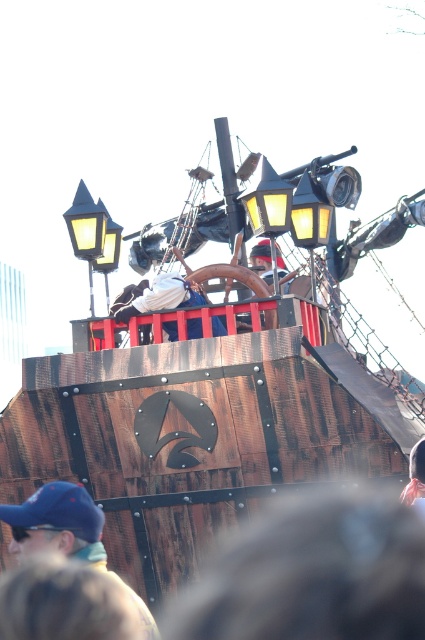
How far apart are blue fabric cap at lower left and white fabric at center?

blue fabric cap at lower left is 16.23 meters away from white fabric at center.

Between blue fabric cap at lower left and white fabric at center, which one has less height?

Standing shorter between the two is white fabric at center.

What do you see at coordinates (65, 532) in the screenshot? This screenshot has height=640, width=425. I see `blue fabric cap at lower left` at bounding box center [65, 532].

Where is `blue fabric cap at lower left`? This screenshot has height=640, width=425. blue fabric cap at lower left is located at coordinates (65, 532).